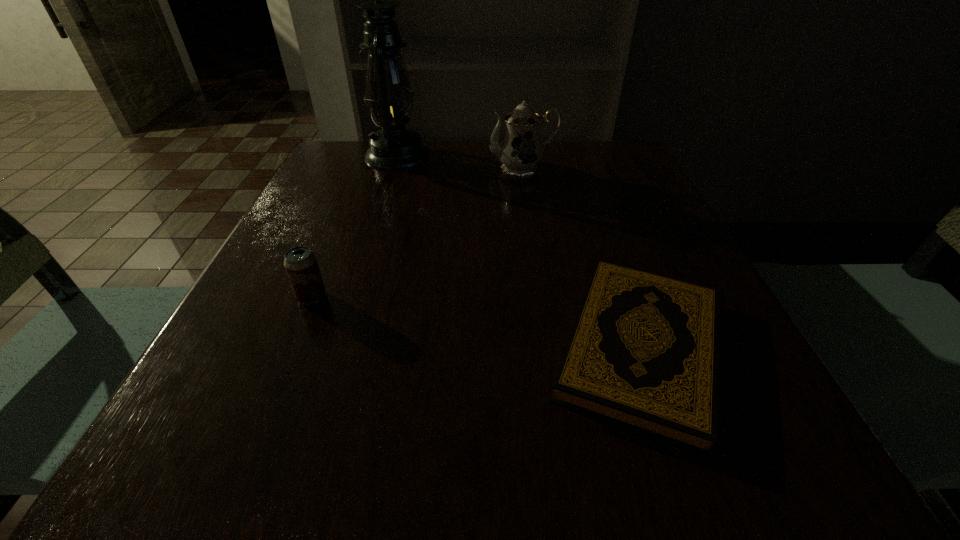
Identify the location of vacant space at the far left corner. The image size is (960, 540). (343, 177).

Find the location of a particular element. free space at the near left corner is located at coordinates (282, 443).

Find the location of a particular element. vacant point at the far right corner is located at coordinates (636, 183).

In the image, there is a desktop. Where is `free space at the near right corner`? The height and width of the screenshot is (540, 960). free space at the near right corner is located at coordinates (786, 429).

The height and width of the screenshot is (540, 960). In order to click on vacant space that is in between the oil lamp and the hardback book in this screenshot , I will do `click(518, 251)`.

Locate an element on the screen. unoccupied area between the oil lamp and the third shortest object is located at coordinates (460, 161).

The width and height of the screenshot is (960, 540). Identify the location of vacant region between the tallest object and the hardback book. (518, 251).

Where is `vacant space that is in between the third shortest object and the tallest object`? This screenshot has height=540, width=960. vacant space that is in between the third shortest object and the tallest object is located at coordinates (460, 161).

Where is `vacant space in between the third shortest object and the shortest object`? Image resolution: width=960 pixels, height=540 pixels. vacant space in between the third shortest object and the shortest object is located at coordinates coord(582,258).

Locate an element on the screen. free space between the shortest object and the tallest object is located at coordinates (518, 251).